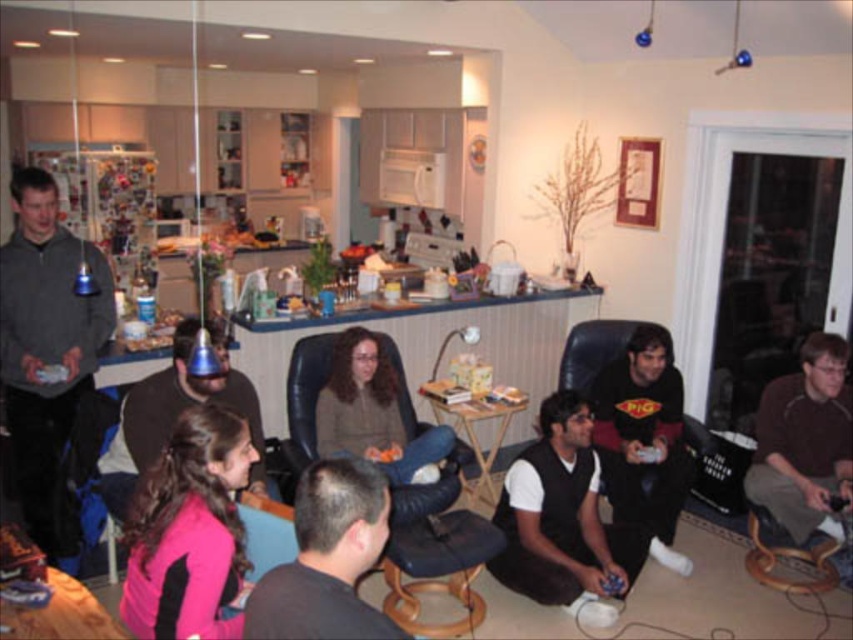
Question: Estimate the real-world distances between objects in this image. Which object is closer to the pink fabric shirt at center?

Choices:
 (A) gray matte jacket at left
 (B) black leather armchair at center
 (C) pink fabric shirt at lower left

Answer: (C)

Question: Considering the relative positions of brown fabric shirt at lower right and pink fabric shirt at center in the image provided, where is brown fabric shirt at lower right located with respect to pink fabric shirt at center?

Choices:
 (A) right
 (B) left

Answer: (A)

Question: Can you confirm if pink fabric shirt at lower left is thinner than dark gray hair at center?

Choices:
 (A) no
 (B) yes

Answer: (A)

Question: Does black leather armchair at center have a lesser width compared to brown fabric shirt at lower right?

Choices:
 (A) yes
 (B) no

Answer: (B)

Question: Estimate the real-world distances between objects in this image. Which object is closer to the dark gray hair at center?

Choices:
 (A) pink fabric shirt at center
 (B) gray matte jacket at left
 (C) pink fabric shirt at lower left
 (D) black matte shirt at lower right

Answer: (C)

Question: Estimate the real-world distances between objects in this image. Which object is closer to the black leather armchair at center?

Choices:
 (A) brown fabric shirt at lower right
 (B) wooden textured stool at lower center
 (C) gray matte jacket at left
 (D) black matte shirt at lower right

Answer: (B)